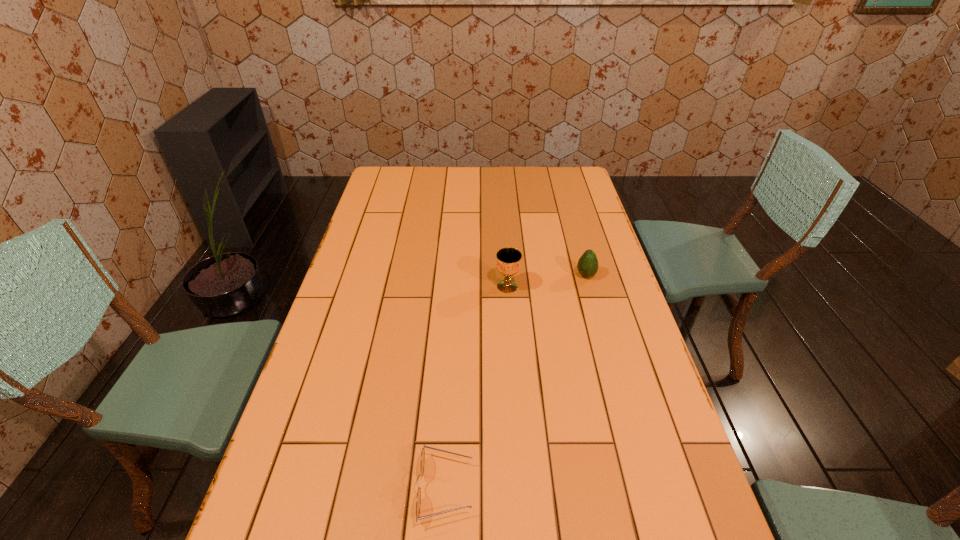
Where is `chalice`? This screenshot has width=960, height=540. chalice is located at coordinates (508, 259).

This screenshot has height=540, width=960. Identify the location of the second object from left to right. (508, 259).

This screenshot has height=540, width=960. I want to click on avocado, so tap(587, 266).

Locate an element on the screen. The width and height of the screenshot is (960, 540). the second tallest object is located at coordinates (587, 266).

Where is `the nearest object`? The width and height of the screenshot is (960, 540). the nearest object is located at coordinates (418, 502).

Locate an element on the screen. The image size is (960, 540). spectacles is located at coordinates (418, 502).

Find the location of `free location located 0.280m on the right of the tallest object`. free location located 0.280m on the right of the tallest object is located at coordinates (607, 286).

Where is `free space located 0.140m on the left of the second tallest object`? The width and height of the screenshot is (960, 540). free space located 0.140m on the left of the second tallest object is located at coordinates (534, 275).

You are a GUI agent. You are given a task and a screenshot of the screen. Output one action in this format:
    pyautogui.click(x=<x>, y=<y>)
    Task: Click on the blank area located 0.390m on the front-facing side of the leftmost object
    This screenshot has width=960, height=540.
    Given the screenshot: What is the action you would take?
    pyautogui.click(x=655, y=488)

At what (x,y) coordinates should I click in order to perform the action: click on object positioned at the right edge. Please return your answer as a coordinate pair (x, y). Looking at the image, I should click on (587, 266).